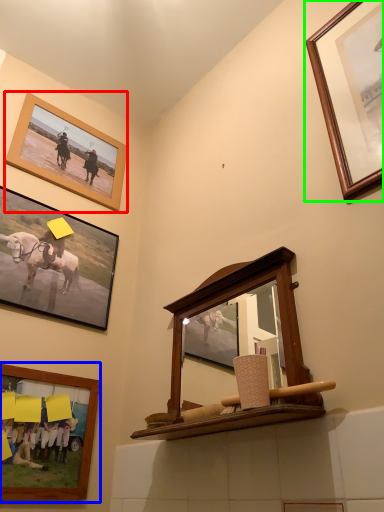
Question: Which is farther away from picture frame (highlighted by a red box)? picture frame (highlighted by a blue box) or picture frame (highlighted by a green box)?

Choices:
 (A) picture frame
 (B) picture frame

Answer: (B)